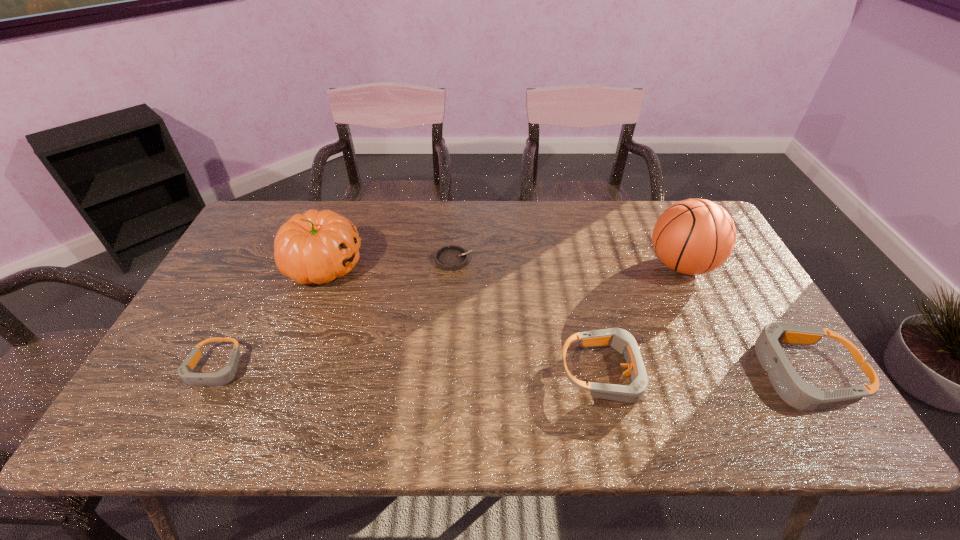
Where is `basketball that is at the right edge`? This screenshot has width=960, height=540. basketball that is at the right edge is located at coordinates (695, 236).

Where is `object that is at the near left corner`? This screenshot has height=540, width=960. object that is at the near left corner is located at coordinates (225, 375).

Identify the location of object that is positioned at the far right corner. The height and width of the screenshot is (540, 960). pyautogui.click(x=695, y=236).

The height and width of the screenshot is (540, 960). What are the coordinates of `object that is at the near right corner` in the screenshot? It's located at tap(795, 391).

In the image, there is a desktop. At what (x,y) coordinates should I click in order to perform the action: click on vacant space at the far edge. Please return your answer as a coordinate pair (x, y). This screenshot has height=540, width=960. Looking at the image, I should click on (564, 202).

Where is `free space at the near edge`? This screenshot has width=960, height=540. free space at the near edge is located at coordinates (732, 393).

You are a GUI agent. You are given a task and a screenshot of the screen. Output one action in this format:
    pyautogui.click(x=<x>, y=<y>)
    Task: Click on the vacant space at the left edge of the desktop
    The width and height of the screenshot is (960, 540).
    Given the screenshot: What is the action you would take?
    pyautogui.click(x=257, y=256)

Locate an element on the screen. Image resolution: width=960 pixels, height=540 pixels. vacant space at the right edge of the desktop is located at coordinates (713, 323).

The width and height of the screenshot is (960, 540). Find the location of `free space that is in between the basketball and the second shortest goggles`. free space that is in between the basketball and the second shortest goggles is located at coordinates (643, 319).

I want to click on vacant space that's between the ashtray and the rightmost goggles, so click(628, 317).